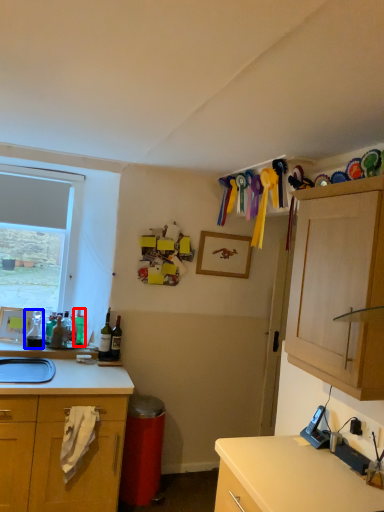
Question: Which point is further to the camera, bottle (highlighted by a red box) or bottle (highlighted by a blue box)?

Choices:
 (A) bottle
 (B) bottle

Answer: (A)